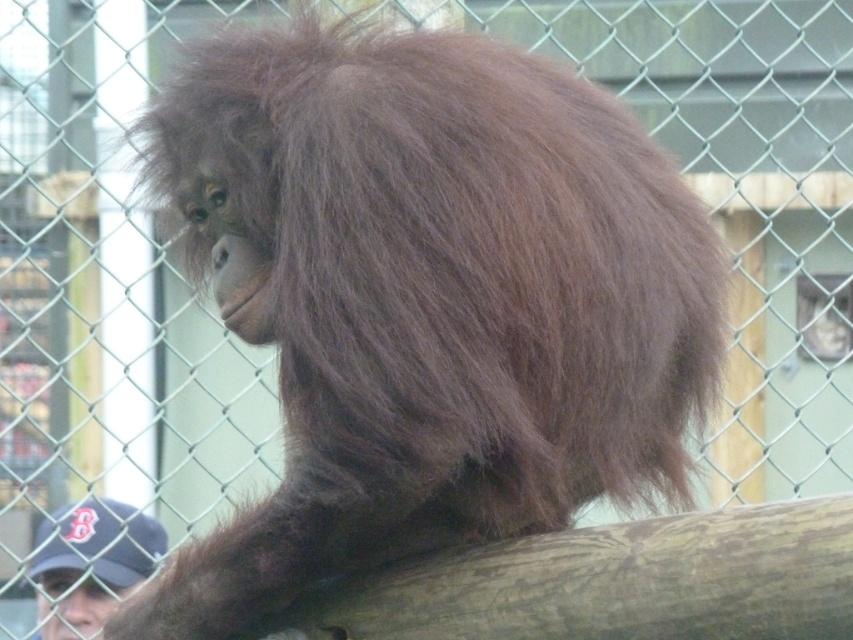
From the picture: Is brown furry orangutan at center taller than dark blue baseball cap at lower left?

Yes.

In order to click on brown furry orangutan at center in this screenshot , I will do `click(427, 300)`.